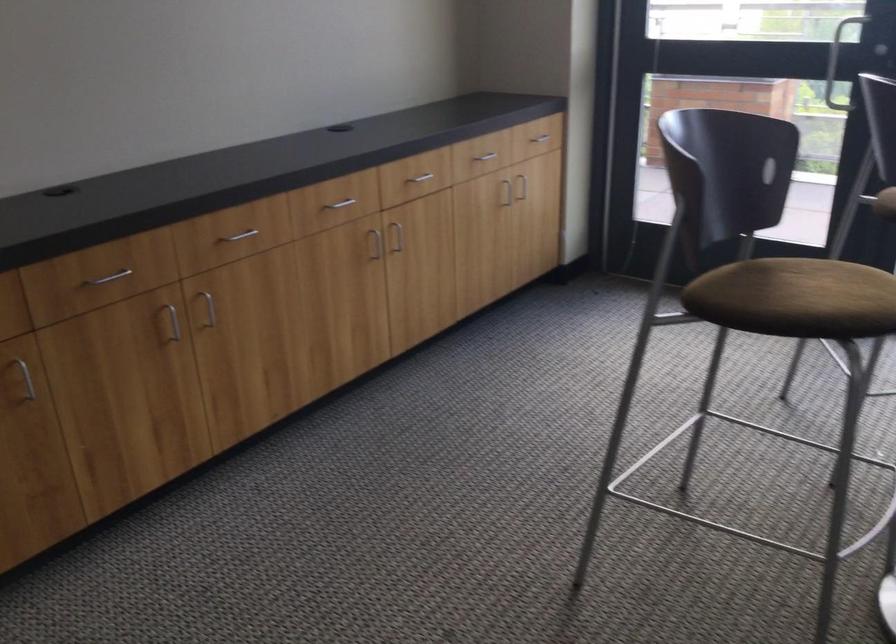
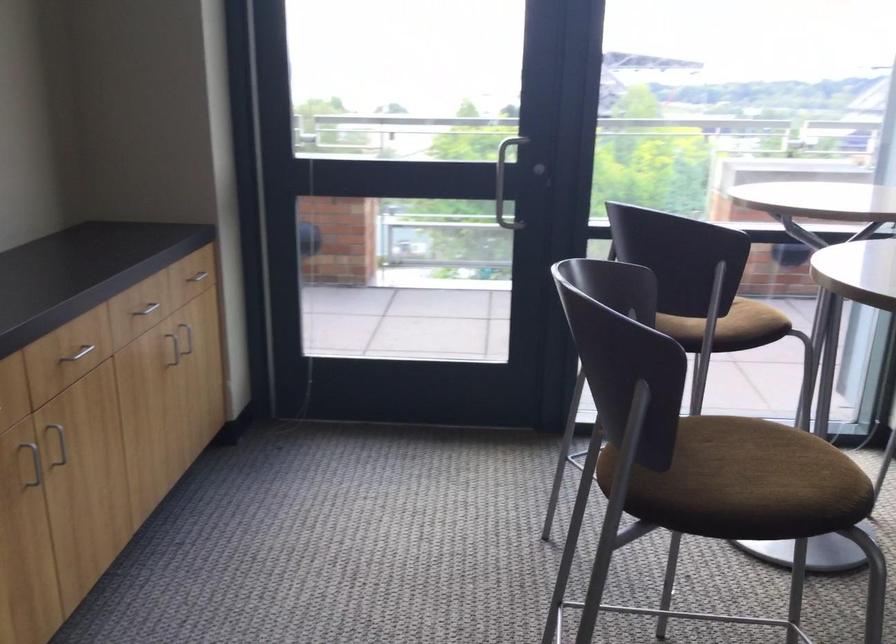
Locate, in the second image, the point that corresponds to point (530, 133) in the first image.

(194, 279)